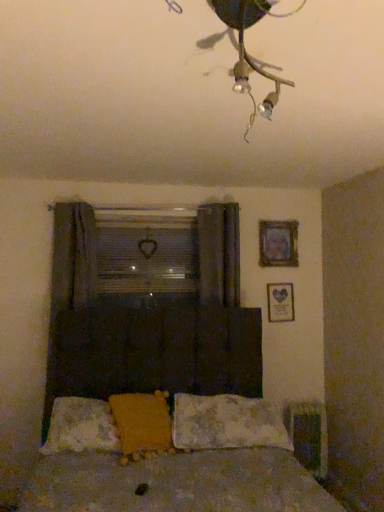
Where is `dark wood bed at center`? Image resolution: width=384 pixels, height=512 pixels. dark wood bed at center is located at coordinates (171, 459).

What is the approximate height of dark wood bed at center?

4.54 feet.

This screenshot has height=512, width=384. Describe the element at coordinates (309, 435) in the screenshot. I see `metallic silver radiator at lower right` at that location.

Identify the location of fluffy white pillow at center, placed as the first pillow when sorted from right to left. coord(226,423).

Locate an element on the screen. This screenshot has width=384, height=512. dark wood bed at center is located at coordinates (171, 459).

Are fluffy white pillow at lower center, which appears as the third pillow when viewed from the right, and yellow fuzzy pillow at center, placed as the 2th pillow when sorted from right to left, located far from each other?

No, there isn't a large distance between fluffy white pillow at lower center, which appears as the third pillow when viewed from the right, and yellow fuzzy pillow at center, placed as the 2th pillow when sorted from right to left.

Which of these two, fluffy white pillow at lower center, which appears as the third pillow when viewed from the right, or yellow fuzzy pillow at center, acting as the 2th pillow starting from the left, is wider?

yellow fuzzy pillow at center, acting as the 2th pillow starting from the left, is wider.

From the image's perspective, does fluffy white pillow at lower center, the first pillow from the left, appear higher than yellow fuzzy pillow at center, placed as the 2th pillow when sorted from right to left?

No.

Is fluffy white pillow at lower center, the first pillow from the left, inside the boundaries of yellow fuzzy pillow at center, acting as the 2th pillow starting from the left, or outside?

fluffy white pillow at lower center, the first pillow from the left, is inside yellow fuzzy pillow at center, acting as the 2th pillow starting from the left.

Find the location of a particular element. This screenshot has height=512, width=384. the 2nd curtain above the yellow fuzzy pillow at center, acting as the 2th pillow starting from the left (from the image's perspective) is located at coordinates (219, 253).

Based on the photo, between yellow fuzzy pillow at center, acting as the 2th pillow starting from the left, and dark fabric curtain at center, which appears as the 2th curtain when viewed from the left, which one appears on the left side from the viewer's perspective?

yellow fuzzy pillow at center, acting as the 2th pillow starting from the left, is more to the left.

Is yellow fuzzy pillow at center, placed as the 2th pillow when sorted from right to left, positioned with its back to dark fabric curtain at center, the first curtain positioned from the right?

No, yellow fuzzy pillow at center, placed as the 2th pillow when sorted from right to left,'s orientation is not away from dark fabric curtain at center, the first curtain positioned from the right.

Which is nearer, (x=189, y=233) or (x=52, y=293)?

Positioned in front is point (x=52, y=293).

Is clear plastic window screen at center looking in the opposite direction of dark fabric curtain at left, the 2th curtain in the right-to-left sequence?

No, dark fabric curtain at left, the 2th curtain in the right-to-left sequence, is not at the back of clear plastic window screen at center.

Measure the distance between clear plastic window screen at center and dark fabric curtain at left, which appears as the 1th curtain when viewed from the left.

clear plastic window screen at center and dark fabric curtain at left, which appears as the 1th curtain when viewed from the left, are 15.07 inches apart from each other.

Relative to dark fabric curtain at left, the 2th curtain in the right-to-left sequence, is clear plastic window screen at center in front or behind?

clear plastic window screen at center is behind dark fabric curtain at left, the 2th curtain in the right-to-left sequence.

In terms of width, does wooden picture frame at upper right, marked as the 2th picture frame in a bottom-to-top arrangement, look wider or thinner when compared to dark fabric curtain at left, the 2th curtain in the right-to-left sequence?

wooden picture frame at upper right, marked as the 2th picture frame in a bottom-to-top arrangement, is thinner than dark fabric curtain at left, the 2th curtain in the right-to-left sequence.

Are wooden picture frame at upper right, which is the 1th picture frame in top-to-bottom order, and dark fabric curtain at left, the 2th curtain in the right-to-left sequence, located far from each other?

Yes, wooden picture frame at upper right, which is the 1th picture frame in top-to-bottom order, and dark fabric curtain at left, the 2th curtain in the right-to-left sequence, are located far from each other.

Is wooden picture frame at upper right, which is the 1th picture frame in top-to-bottom order, to the right of dark fabric curtain at left, which appears as the 1th curtain when viewed from the left, from the viewer's perspective?

Indeed, wooden picture frame at upper right, which is the 1th picture frame in top-to-bottom order, is positioned on the right side of dark fabric curtain at left, which appears as the 1th curtain when viewed from the left.

Starting from the dark fabric curtain at left, the 2th curtain in the right-to-left sequence, which picture frame is the 1st one to the right? Please provide its 2D coordinates.

[(278, 243)]

From the image's perspective, which is above, clear plastic window screen at center or dark fabric curtain at center, the first curtain positioned from the right?

From the image's view, dark fabric curtain at center, the first curtain positioned from the right, is above.

Between clear plastic window screen at center and dark fabric curtain at center, which appears as the 2th curtain when viewed from the left, which one has less height?

clear plastic window screen at center is shorter.

Would you say clear plastic window screen at center contains dark fabric curtain at center, the first curtain positioned from the right?

Actually, dark fabric curtain at center, the first curtain positioned from the right, is outside clear plastic window screen at center.

Based on the photo, is dark wood bed at center thinner than metallic silver radiator at lower right?

No, dark wood bed at center is not thinner than metallic silver radiator at lower right.

From the image's perspective, which one is positioned higher, dark wood bed at center or metallic silver radiator at lower right?

dark wood bed at center, from the image's perspective.

In the scene shown: Does dark wood bed at center have a greater height compared to metallic silver radiator at lower right?

Yes.

Is dark wood bed at center to the left or to the right of metallic silver radiator at lower right in the image?

From the image, it's evident that dark wood bed at center is to the left of metallic silver radiator at lower right.

Does metallic silver radiator at lower right have a lesser height compared to fluffy white pillow at center, placed as the first pillow when sorted from right to left?

No.

Is metallic silver radiator at lower right thinner than fluffy white pillow at center, placed as the first pillow when sorted from right to left?

Indeed, metallic silver radiator at lower right has a lesser width compared to fluffy white pillow at center, placed as the first pillow when sorted from right to left.

Which is more to the left, metallic silver radiator at lower right or fluffy white pillow at center, the third pillow when ordered from left to right?

fluffy white pillow at center, the third pillow when ordered from left to right, is more to the left.

Which is closer, (x=320, y=461) or (x=176, y=426)?

Point (x=320, y=461).

Where is `pillow above the fluffy white pillow at lower center, the first pillow from the left (from a real-world perspective)`? The height and width of the screenshot is (512, 384). pillow above the fluffy white pillow at lower center, the first pillow from the left (from a real-world perspective) is located at coordinates (142, 423).

Locate an element on the screen. The width and height of the screenshot is (384, 512). the 1st pillow directly beneath the dark fabric curtain at center, the first curtain positioned from the right (from a real-world perspective) is located at coordinates (142, 423).

Which object lies nearer to the anchor point dark fabric curtain at center, the first curtain positioned from the right, yellow fuzzy pillow at center, acting as the 2th pillow starting from the left, or clear plastic window screen at center?

Among the two, clear plastic window screen at center is located nearer to dark fabric curtain at center, the first curtain positioned from the right.

From the image, which object appears to be farther from wooden picture frame at upper right, which is the 1th picture frame in top-to-bottom order, metallic silver radiator at lower right or matte silver picture frame at upper right, which appears as the 2th picture frame when viewed from the top?

metallic silver radiator at lower right lies further to wooden picture frame at upper right, which is the 1th picture frame in top-to-bottom order, than the other object.

When comparing their distances from matte silver picture frame at upper right, marked as the first picture frame in a bottom-to-top arrangement, does dark wood bed at center or dark fabric curtain at center, which appears as the 2th curtain when viewed from the left, seem closer?

Among the two, dark fabric curtain at center, which appears as the 2th curtain when viewed from the left, is located nearer to matte silver picture frame at upper right, marked as the first picture frame in a bottom-to-top arrangement.

When comparing their distances from fluffy white pillow at center, placed as the first pillow when sorted from right to left, does dark wood bed at center or matte silver picture frame at upper right, which appears as the 2th picture frame when viewed from the top, seem further?

Based on the image, matte silver picture frame at upper right, which appears as the 2th picture frame when viewed from the top, appears to be further to fluffy white pillow at center, placed as the first pillow when sorted from right to left.

When comparing their distances from dark fabric curtain at center, which appears as the 2th curtain when viewed from the left, does metallic wire at upper center or clear plastic window screen at center seem further?

metallic wire at upper center.

Based on their spatial positions, is matte silver picture frame at upper right, marked as the first picture frame in a bottom-to-top arrangement, or dark fabric curtain at left, which appears as the 1th curtain when viewed from the left, further from yellow fuzzy pillow at center, placed as the 2th pillow when sorted from right to left?

matte silver picture frame at upper right, marked as the first picture frame in a bottom-to-top arrangement, lies further to yellow fuzzy pillow at center, placed as the 2th pillow when sorted from right to left, than the other object.

Considering their positions, is matte silver picture frame at upper right, which appears as the 2th picture frame when viewed from the top, positioned closer to dark fabric curtain at center, the first curtain positioned from the right, than fluffy white pillow at lower center, the first pillow from the left?

The object closer to dark fabric curtain at center, the first curtain positioned from the right, is matte silver picture frame at upper right, which appears as the 2th picture frame when viewed from the top.

Based on their spatial positions, is wooden picture frame at upper right, which is the 1th picture frame in top-to-bottom order, or clear plastic window screen at center closer to metallic wire at upper center?

Based on the image, clear plastic window screen at center appears to be nearer to metallic wire at upper center.

Find the location of `picture frame between dark fabric curtain at center, the first curtain positioned from the right, and matte silver picture frame at upper right, which appears as the 2th picture frame when viewed from the top, from left to right`. picture frame between dark fabric curtain at center, the first curtain positioned from the right, and matte silver picture frame at upper right, which appears as the 2th picture frame when viewed from the top, from left to right is located at coordinates (278, 243).

Where is `window screen located between dark fabric curtain at left, which appears as the 1th curtain when viewed from the left, and fluffy white pillow at center, the third pillow when ordered from left to right, in the left-right direction`? window screen located between dark fabric curtain at left, which appears as the 1th curtain when viewed from the left, and fluffy white pillow at center, the third pillow when ordered from left to right, in the left-right direction is located at coordinates (146, 252).

What are the coordinates of `picture frame situated between fluffy white pillow at lower center, the first pillow from the left, and matte silver picture frame at upper right, marked as the first picture frame in a bottom-to-top arrangement, from left to right` in the screenshot? It's located at (278, 243).

What are the coordinates of `picture frame between wooden picture frame at upper right, which is the 1th picture frame in top-to-bottom order, and fluffy white pillow at center, the third pillow when ordered from left to right, in the vertical direction` in the screenshot? It's located at click(280, 302).